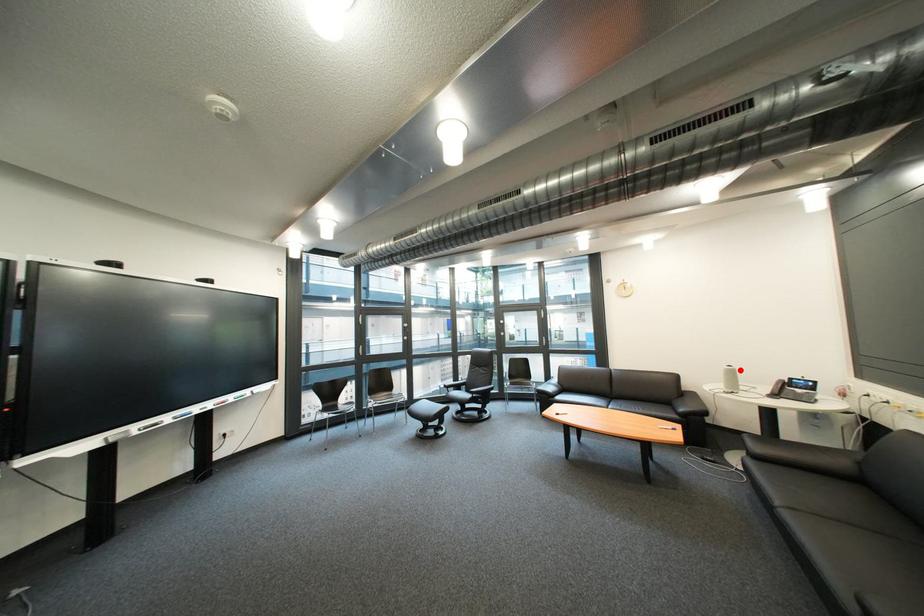
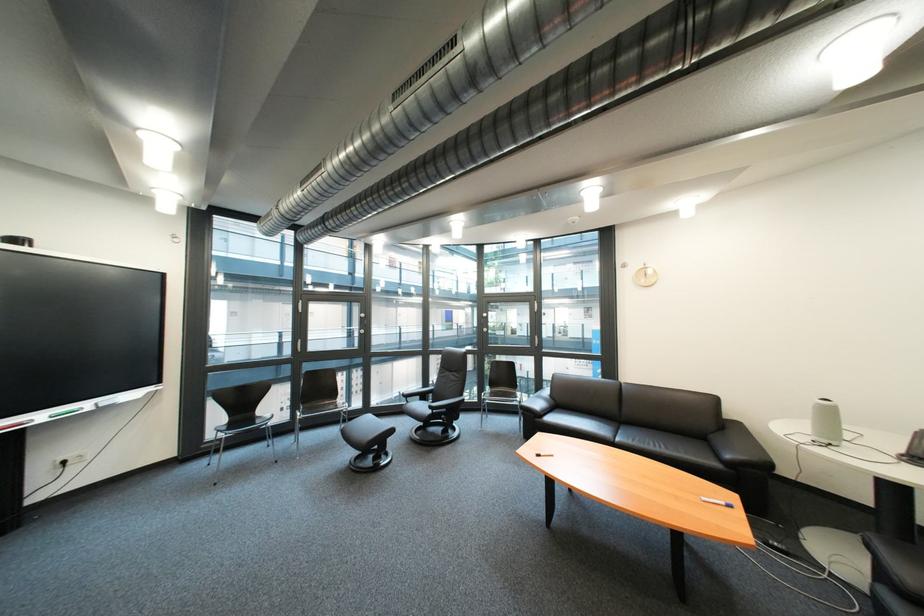
Find the pixel in the second image that matches the highlighted location in the first image.

(833, 406)